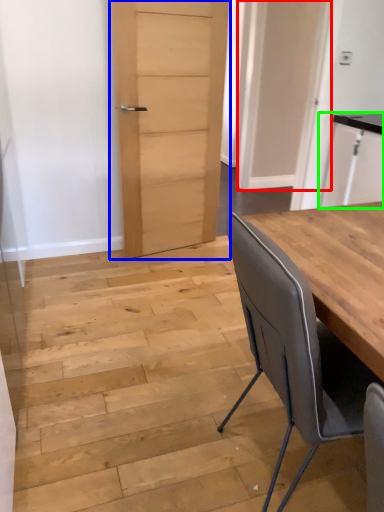
Question: Which object is the farthest from door (highlighted by a red box)? Choose among these: door (highlighted by a blue box) or cabinetry (highlighted by a green box).

Choices:
 (A) door
 (B) cabinetry

Answer: (A)